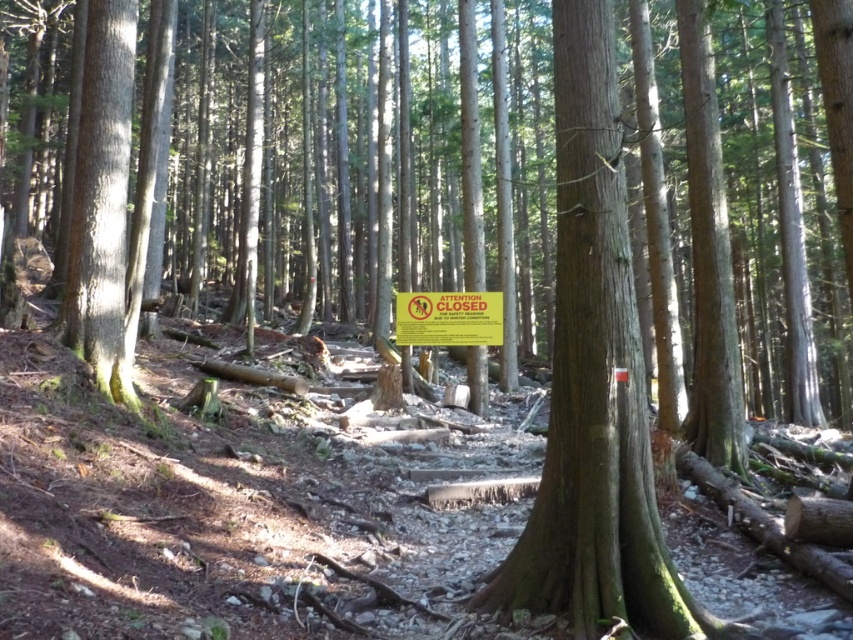
Between point (572, 358) and point (482, 340), which one is positioned in front?

Point (572, 358) is more forward.

Measure the distance between smooth brown tree trunk at center and yellow paper sign at center.

A distance of 4.13 meters exists between smooth brown tree trunk at center and yellow paper sign at center.

What do you see at coordinates (595, 385) in the screenshot? The image size is (853, 640). I see `smooth brown tree trunk at center` at bounding box center [595, 385].

The width and height of the screenshot is (853, 640). Find the location of `smooth brown tree trunk at center`. smooth brown tree trunk at center is located at coordinates (595, 385).